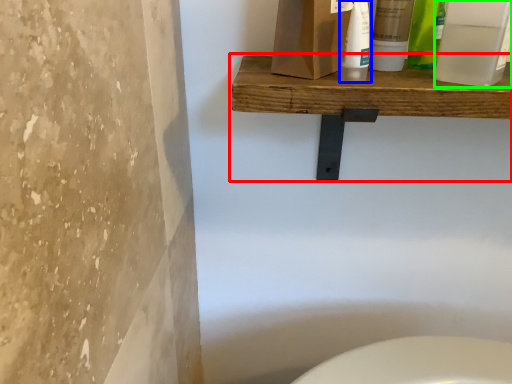
Question: Considering the real-world distances, which object is closest to shelf (highlighted by a red box)? cleaning product (highlighted by a blue box) or mouthwash (highlighted by a green box).

Choices:
 (A) cleaning product
 (B) mouthwash

Answer: (A)